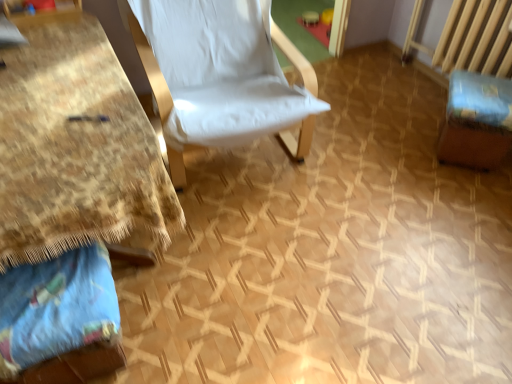
At what (x,y) coordinates should I click in order to perform the action: click on free space to the back side of brown fabric swivel chair at right. Please return your answer as a coordinate pair (x, y). This screenshot has height=384, width=512. Looking at the image, I should click on (414, 115).